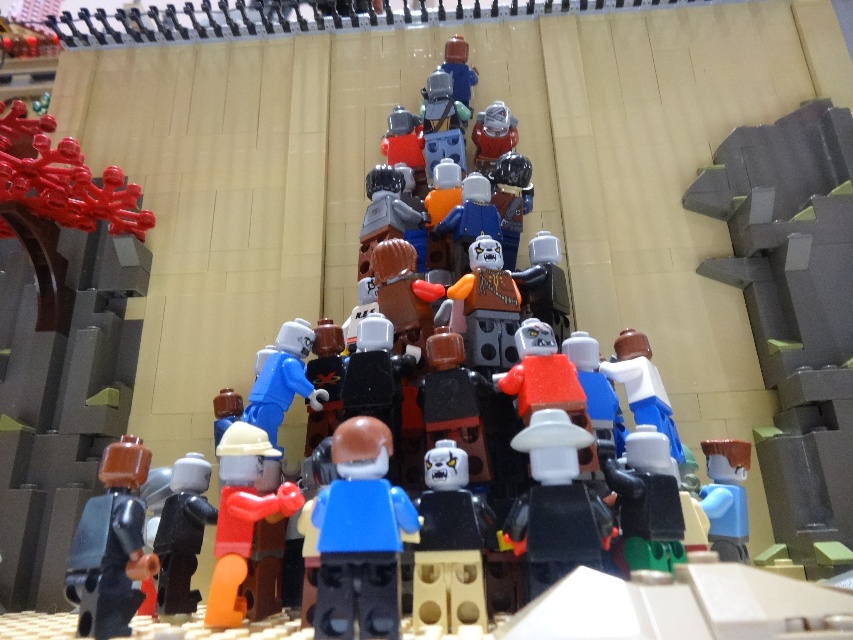
Question: Which object is positioned closest to the black plastic minifigure at center?

Choices:
 (A) green matte minifigure at center
 (B) black matte skull head at center
 (C) black matte minifigure at lower left
 (D) white matte cowboy hat at center

Answer: (C)

Question: Which of these objects is positioned closest to the white matte cowboy hat at center?

Choices:
 (A) black matte minifigure at lower left
 (B) matte orange figure at center
 (C) blue plastic figure at center
 (D) green matte minifigure at center

Answer: (D)

Question: Where is blue plastic figure at center located in relation to white matte cowboy hat at center in the image?

Choices:
 (A) below
 (B) above

Answer: (A)

Question: Can you confirm if white matte cowboy hat at center is positioned above black matte minifigure at lower left?

Choices:
 (A) no
 (B) yes

Answer: (B)

Question: Which point is farther to the camera?

Choices:
 (A) green matte minifigure at center
 (B) white matte cowboy hat at center
 (C) black matte skull head at center
 (D) matte orange figure at center

Answer: (A)

Question: Does blue plastic figure at center appear over black plastic minifigure at center?

Choices:
 (A) yes
 (B) no

Answer: (A)